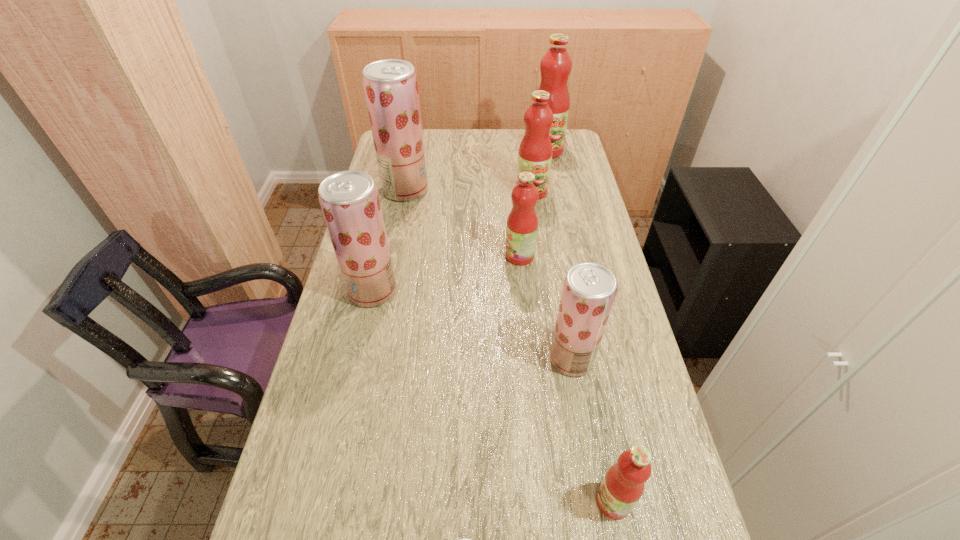
This screenshot has width=960, height=540. In order to click on vacant area that lies between the fourth nearest fruit juice and the third nearest pink fruit juice in this screenshot , I will do `click(452, 241)`.

The image size is (960, 540). I want to click on unoccupied position between the second smallest pink fruit juice and the biggest strawberry fruit juice, so click(463, 223).

Find the location of a particular element. The image size is (960, 540). vacant area between the second nearest pink fruit juice and the second biggest strawberry fruit juice is located at coordinates (446, 273).

Locate an element on the screen. empty location between the farthest object and the farthest strawberry fruit juice is located at coordinates (476, 170).

Point out which object is positioned as the third nearest to the fourth nearest fruit juice. Please provide its 2D coordinates. Your answer should be formatted as a tuple, i.e. [(x, y)], where the tuple contains the x and y coordinates of a point satisfying the conditions above.

[(589, 290)]

Where is `object that is the fifth closest one to the third smallest pink fruit juice`? This screenshot has width=960, height=540. object that is the fifth closest one to the third smallest pink fruit juice is located at coordinates (589, 290).

The image size is (960, 540). In order to click on fruit juice object that ranks as the second closest to the biggest strawberry fruit juice in this screenshot , I will do `click(349, 200)`.

Identify which fruit juice is the second nearest to the third nearest pink fruit juice. Please provide its 2D coordinates. Your answer should be formatted as a tuple, i.e. [(x, y)], where the tuple contains the x and y coordinates of a point satisfying the conditions above.

[(522, 223)]

Select which strawberry fruit juice appears as the second closest to the fourth nearest object. Please provide its 2D coordinates. Your answer should be formatted as a tuple, i.e. [(x, y)], where the tuple contains the x and y coordinates of a point satisfying the conditions above.

[(589, 290)]

Choose which strawberry fruit juice is the third nearest neighbor to the third nearest strawberry fruit juice. Please provide its 2D coordinates. Your answer should be formatted as a tuple, i.e. [(x, y)], where the tuple contains the x and y coordinates of a point satisfying the conditions above.

[(462, 539)]